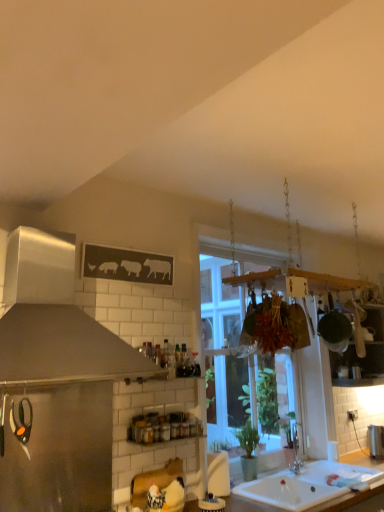
Where is `brushed metal trash can at lower right, which is the 1th appliance from right to left`? The image size is (384, 512). brushed metal trash can at lower right, which is the 1th appliance from right to left is located at coordinates (375, 441).

From a real-world perspective, is clear glass window at center physically located above or below white ceramic sink at lower center?

clear glass window at center is above white ceramic sink at lower center.

From the image's perspective, who appears lower, clear glass window at center or white ceramic sink at lower center?

white ceramic sink at lower center appears lower in the image.

How different are the orientations of clear glass window at center and white ceramic sink at lower center in degrees?

0.382 degrees.

Find the location of a particular element. sink below the clear glass window at center (from the image's perspective) is located at coordinates (307, 486).

From the image's perspective, which object appears higher, white ceramic sink at lower center or clear glass window at center?

clear glass window at center appears higher in the image.

Is white ceramic sink at lower center thinner than clear glass window at center?

No, white ceramic sink at lower center is not thinner than clear glass window at center.

Does white ceramic sink at lower center have a larger size compared to clear glass window at center?

No.

Is white ceramic sink at lower center positioned behind clear glass window at center?

No, it is not.

From the image's perspective, is brushed metal trash can at lower right, acting as the 3th appliance starting from the left, positioned above or below clear glass window at center?

Clearly, from the image's perspective, brushed metal trash can at lower right, acting as the 3th appliance starting from the left, is below clear glass window at center.

From a real-world perspective, which is physically above, brushed metal trash can at lower right, which is the 1th appliance from right to left, or clear glass window at center?

From a 3D spatial view, clear glass window at center is above.

Which object is further away from the camera, brushed metal trash can at lower right, acting as the 3th appliance starting from the left, or clear glass window at center?

Positioned behind is brushed metal trash can at lower right, acting as the 3th appliance starting from the left.

Between point (88, 401) and point (271, 419), which one is positioned in front?

The point (88, 401) is closer.

The width and height of the screenshot is (384, 512). What are the coordinates of `window above the stainless steel refrigerator at lower left, marked as the 3th appliance in a back-to-front arrangement (from a real-world perspective)` in the screenshot? It's located at (222, 344).

Is there a large distance between stainless steel refrigerator at lower left, arranged as the second appliance when viewed from the right, and clear glass window at center?

Yes, stainless steel refrigerator at lower left, arranged as the second appliance when viewed from the right, is far from clear glass window at center.

Consider the image. Does stainless steel refrigerator at lower left, marked as the 3th appliance in a back-to-front arrangement, have a lesser width compared to clear glass window at center?

In fact, stainless steel refrigerator at lower left, marked as the 3th appliance in a back-to-front arrangement, might be wider than clear glass window at center.

Which is more to the right, white glossy countertop at lower center or stainless steel refrigerator at lower left, marked as the 3th appliance in a back-to-front arrangement?

white glossy countertop at lower center.

Who is smaller, white glossy countertop at lower center or stainless steel refrigerator at lower left, arranged as the second appliance when viewed from the right?

Smaller between the two is stainless steel refrigerator at lower left, arranged as the second appliance when viewed from the right.

Would you consider white glossy countertop at lower center to be distant from stainless steel refrigerator at lower left, arranged as the second appliance when viewed from the right?

white glossy countertop at lower center is actually quite close to stainless steel refrigerator at lower left, arranged as the second appliance when viewed from the right.

Would you say stainless steel refrigerator at lower left, which ranks as the second appliance in top-to-bottom order, is part of white glossy countertop at lower center's contents?

That's incorrect, stainless steel refrigerator at lower left, which ranks as the second appliance in top-to-bottom order, is not inside white glossy countertop at lower center.

Which is behind, point (17, 457) or point (121, 499)?

Positioned behind is point (121, 499).

Which of these two, stainless steel refrigerator at lower left, which ranks as the 1th appliance in front-to-back order, or white glossy countertop at lower center, is wider?

white glossy countertop at lower center is wider.

Considering the relative sizes of stainless steel refrigerator at lower left, arranged as the second appliance when viewed from the right, and white glossy countertop at lower center in the image provided, is stainless steel refrigerator at lower left, arranged as the second appliance when viewed from the right, taller than white glossy countertop at lower center?

Correct, stainless steel refrigerator at lower left, arranged as the second appliance when viewed from the right, is much taller as white glossy countertop at lower center.

Consider the image. Considering the relative positions of stainless steel refrigerator at lower left, arranged as the second appliance when viewed from the right, and white glossy countertop at lower center in the image provided, is stainless steel refrigerator at lower left, arranged as the second appliance when viewed from the right, to the left or to the right of white glossy countertop at lower center?

From the image, it's evident that stainless steel refrigerator at lower left, arranged as the second appliance when viewed from the right, is to the left of white glossy countertop at lower center.

Which of these two, matte black scissors at left, which ranks as the 3th appliance in bottom-to-top order, or white ceramic sink at lower center, stands taller?

With more height is matte black scissors at left, which ranks as the 3th appliance in bottom-to-top order.

Is matte black scissors at left, which ranks as the 3th appliance in bottom-to-top order, directly adjacent to white ceramic sink at lower center?

matte black scissors at left, which ranks as the 3th appliance in bottom-to-top order, and white ceramic sink at lower center are not in contact.

Based on the photo, is matte black scissors at left, which ranks as the 3th appliance in bottom-to-top order, wider or thinner than white ceramic sink at lower center?

Clearly, matte black scissors at left, which ranks as the 3th appliance in bottom-to-top order, has less width compared to white ceramic sink at lower center.

Between matte black scissors at left, which is the 2th appliance in front-to-back order, and white ceramic sink at lower center, which one is positioned in front?

matte black scissors at left, which is the 2th appliance in front-to-back order.

At what (x,y) coordinates should I click in order to perform the action: click on window lying behind the white ceramic sink at lower center. Please return your answer as a coordinate pair (x, y). This screenshot has height=512, width=384. Looking at the image, I should click on click(222, 344).

At what (x,y) coordinates should I click in order to perform the action: click on window above the white ceramic sink at lower center (from the image's perspective). Please return your answer as a coordinate pair (x, y). The width and height of the screenshot is (384, 512). Looking at the image, I should click on (222, 344).

Considering their positions, is stainless steel refrigerator at lower left, arranged as the second appliance when viewed from the right, positioned further to clear glass window at center than matte black scissors at left, which ranks as the first appliance in left-to-right order?

matte black scissors at left, which ranks as the first appliance in left-to-right order, is further to clear glass window at center.

From the picture: Considering their positions, is matte black scissors at left, which is the 2th appliance in front-to-back order, positioned further to clear glass window at center than stainless steel refrigerator at lower left, marked as the second appliance in a bottom-to-top arrangement?

matte black scissors at left, which is the 2th appliance in front-to-back order, is positioned further to the anchor clear glass window at center.

From the image, which object appears to be nearer to clear glass window at center, white glossy countertop at lower center or stainless steel refrigerator at lower left, which ranks as the second appliance in top-to-bottom order?

white glossy countertop at lower center is positioned closer to the anchor clear glass window at center.

Estimate the real-world distances between objects in this image. Which object is closer to white glossy countertop at lower center, white ceramic sink at lower center or stainless steel refrigerator at lower left, marked as the second appliance in a bottom-to-top arrangement?

Among the two, white ceramic sink at lower center is located nearer to white glossy countertop at lower center.

When comparing their distances from stainless steel refrigerator at lower left, arranged as the second appliance when viewed from the right, does matte black scissors at left, the 1th appliance positioned from the top, or brushed metal trash can at lower right, positioned as the 3th appliance in top-to-bottom order, seem closer?

Among the two, matte black scissors at left, the 1th appliance positioned from the top, is located nearer to stainless steel refrigerator at lower left, arranged as the second appliance when viewed from the right.

Looking at the image, which one is located further to clear glass window at center, stainless steel refrigerator at lower left, marked as the 3th appliance in a back-to-front arrangement, or white glossy countertop at lower center?

stainless steel refrigerator at lower left, marked as the 3th appliance in a back-to-front arrangement, lies further to clear glass window at center than the other object.

From the image, which object appears to be farther from stainless steel refrigerator at lower left, arranged as the second appliance when viewed from the right, clear glass window at center or matte black scissors at left, which ranks as the third appliance in right-to-left order?

clear glass window at center is further to stainless steel refrigerator at lower left, arranged as the second appliance when viewed from the right.

From the image, which object appears to be nearer to white glossy countertop at lower center, matte black scissors at left, which is the 2th appliance in front-to-back order, or clear glass window at center?

The object closer to white glossy countertop at lower center is clear glass window at center.

Identify the location of appliance situated between matte black scissors at left, which ranks as the 3th appliance in bottom-to-top order, and brushed metal trash can at lower right, arranged as the 1th appliance when viewed from the back, from left to right. point(62,452).

The image size is (384, 512). In order to click on countertop situated between matte black scissors at left, which appears as the second appliance when viewed from the back, and clear glass window at center from left to right in this screenshot , I will do `click(315, 484)`.

Identify the location of window between matte black scissors at left, which is the 2th appliance in front-to-back order, and brushed metal trash can at lower right, placed as the 1th appliance when sorted from bottom to top. Image resolution: width=384 pixels, height=512 pixels. (222, 344).

The height and width of the screenshot is (512, 384). I want to click on appliance between matte black scissors at left, which appears as the second appliance when viewed from the back, and white glossy countertop at lower center, in the horizontal direction, so click(x=62, y=452).